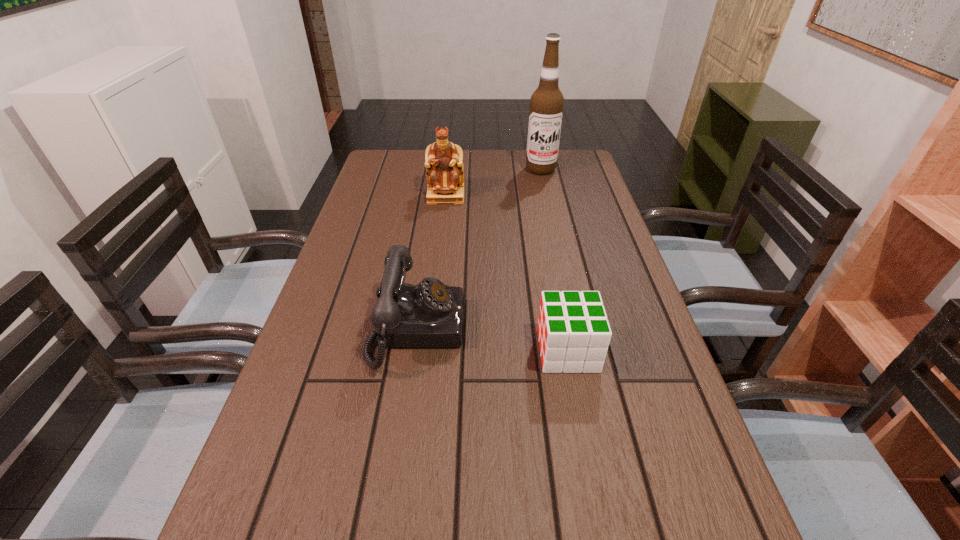
You are a GUI agent. You are given a task and a screenshot of the screen. Output one action in this format:
    pyautogui.click(x=<x>, y=<y>)
    Task: Click on the free region located 0.150m on the red face of the shortest object
    
    Given the screenshot: What is the action you would take?
    pyautogui.click(x=466, y=350)

Identify the location of free space located on the red face of the shortest object. (436, 350).

Where is `object that is at the far edge`? object that is at the far edge is located at coordinates 547,102.

You are a GUI agent. You are given a task and a screenshot of the screen. Output one action in this format:
    pyautogui.click(x=<x>, y=<y>)
    Task: Click on the object located at the left edge
    The image size is (960, 540).
    Given the screenshot: What is the action you would take?
    pos(430,314)

This screenshot has height=540, width=960. Find the location of `alcohol situated at the right edge`. alcohol situated at the right edge is located at coordinates (547, 102).

The width and height of the screenshot is (960, 540). I want to click on cube at the right edge, so click(x=573, y=331).

Locate an element on the screen. object at the far right corner is located at coordinates (547, 102).

The image size is (960, 540). In the image, there is a desktop. Find the location of `vacant space at the left edge`. vacant space at the left edge is located at coordinates (371, 308).

Where is `vacant region at the right edge of the desktop`? The width and height of the screenshot is (960, 540). vacant region at the right edge of the desktop is located at coordinates (639, 327).

In the image, there is a desktop. Identify the location of free region at the far left corner. (393, 159).